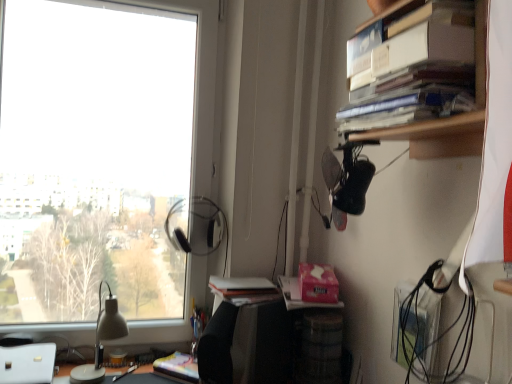
Question: Is matte black desk at lower center bigger than transparent glass window at upper left?

Choices:
 (A) yes
 (B) no

Answer: (B)

Question: Is matte black desk at lower center smaller than transparent glass window at upper left?

Choices:
 (A) no
 (B) yes

Answer: (B)

Question: From the image's perspective, is matte black desk at lower center above transparent glass window at upper left?

Choices:
 (A) no
 (B) yes

Answer: (A)

Question: Are matte black desk at lower center and transparent glass window at upper left far apart?

Choices:
 (A) no
 (B) yes

Answer: (A)

Question: From the image's perspective, is matte black desk at lower center below transparent glass window at upper left?

Choices:
 (A) no
 (B) yes

Answer: (B)

Question: Would you say matte black desk at lower center is outside transparent glass window at upper left?

Choices:
 (A) yes
 (B) no

Answer: (A)

Question: Is hardcover books at upper right in front of transparent glass window at upper left?

Choices:
 (A) yes
 (B) no

Answer: (A)

Question: Considering the relative sizes of hardcover books at upper right and transparent glass window at upper left in the image provided, is hardcover books at upper right shorter than transparent glass window at upper left?

Choices:
 (A) no
 (B) yes

Answer: (B)

Question: Does hardcover books at upper right come behind transparent glass window at upper left?

Choices:
 (A) yes
 (B) no

Answer: (B)

Question: Can we say hardcover books at upper right lies outside transparent glass window at upper left?

Choices:
 (A) yes
 (B) no

Answer: (A)

Question: Would you say hardcover books at upper right contains transparent glass window at upper left?

Choices:
 (A) yes
 (B) no

Answer: (B)

Question: From the image's perspective, is hardcover books at upper right below transparent glass window at upper left?

Choices:
 (A) no
 (B) yes

Answer: (A)

Question: From the image's perspective, is matte white lamp at left located beneath hardcover books at upper right?

Choices:
 (A) yes
 (B) no

Answer: (A)